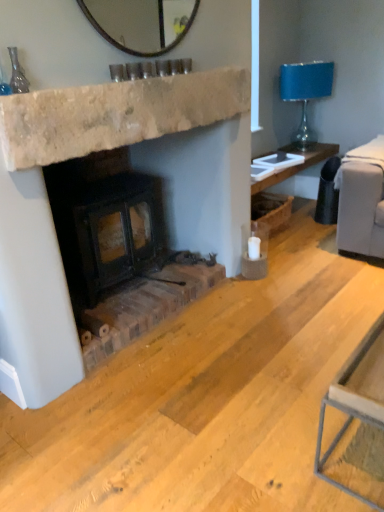
The width and height of the screenshot is (384, 512). Identify the location of vacant space underneath natural stone fireplace at center (from a real-world perspective). (160, 322).